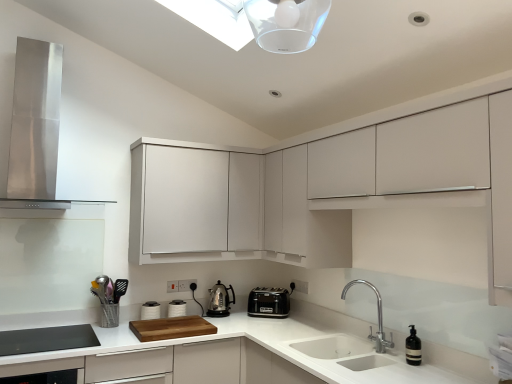
Question: Considering the relative positions of polished stainless steel kettle at center, which is counted as the second kitchen appliance, starting from the right, and black glass dishwasher at lower left in the image provided, is polished stainless steel kettle at center, which is counted as the second kitchen appliance, starting from the right, to the left of black glass dishwasher at lower left from the viewer's perspective?

Choices:
 (A) no
 (B) yes

Answer: (A)

Question: Does polished stainless steel kettle at center, which is counted as the second kitchen appliance, starting from the right, lie behind black glass dishwasher at lower left?

Choices:
 (A) no
 (B) yes

Answer: (B)

Question: Is polished stainless steel kettle at center, marked as the 1th kitchen appliance in a left-to-right arrangement, to the right of black glass dishwasher at lower left from the viewer's perspective?

Choices:
 (A) yes
 (B) no

Answer: (A)

Question: Considering the relative sizes of polished stainless steel kettle at center, which is counted as the second kitchen appliance, starting from the right, and black glass dishwasher at lower left in the image provided, is polished stainless steel kettle at center, which is counted as the second kitchen appliance, starting from the right, taller than black glass dishwasher at lower left?

Choices:
 (A) no
 (B) yes

Answer: (A)

Question: From the image's perspective, is polished stainless steel kettle at center, marked as the 1th kitchen appliance in a left-to-right arrangement, under black glass dishwasher at lower left?

Choices:
 (A) yes
 (B) no

Answer: (B)

Question: From a real-world perspective, is polished stainless steel kettle at center, which is counted as the second kitchen appliance, starting from the right, physically above black glass dishwasher at lower left?

Choices:
 (A) no
 (B) yes

Answer: (B)

Question: Is metallic silver utensil holder at lower left smaller than white matte cabinet at upper center, positioned as the 1th cabinetry in left-to-right order?

Choices:
 (A) yes
 (B) no

Answer: (A)

Question: Can you confirm if metallic silver utensil holder at lower left is taller than white matte cabinet at upper center, acting as the second cabinetry starting from the right?

Choices:
 (A) yes
 (B) no

Answer: (B)

Question: Considering the relative sizes of metallic silver utensil holder at lower left and white matte cabinet at upper center, acting as the second cabinetry starting from the right, in the image provided, is metallic silver utensil holder at lower left bigger than white matte cabinet at upper center, acting as the second cabinetry starting from the right,?

Choices:
 (A) yes
 (B) no

Answer: (B)

Question: From a real-world perspective, does metallic silver utensil holder at lower left sit lower than white matte cabinet at upper center, acting as the second cabinetry starting from the right?

Choices:
 (A) no
 (B) yes

Answer: (B)

Question: From the image's perspective, is metallic silver utensil holder at lower left located above white matte cabinet at upper center, acting as the second cabinetry starting from the right?

Choices:
 (A) yes
 (B) no

Answer: (B)

Question: Considering the relative sizes of metallic silver utensil holder at lower left and white matte cabinet at upper center, acting as the second cabinetry starting from the right, in the image provided, is metallic silver utensil holder at lower left wider than white matte cabinet at upper center, acting as the second cabinetry starting from the right,?

Choices:
 (A) yes
 (B) no

Answer: (B)

Question: Does stainless steel range hood at upper left have a larger size compared to white matte cabinet at upper center, acting as the second cabinetry starting from the right?

Choices:
 (A) yes
 (B) no

Answer: (A)